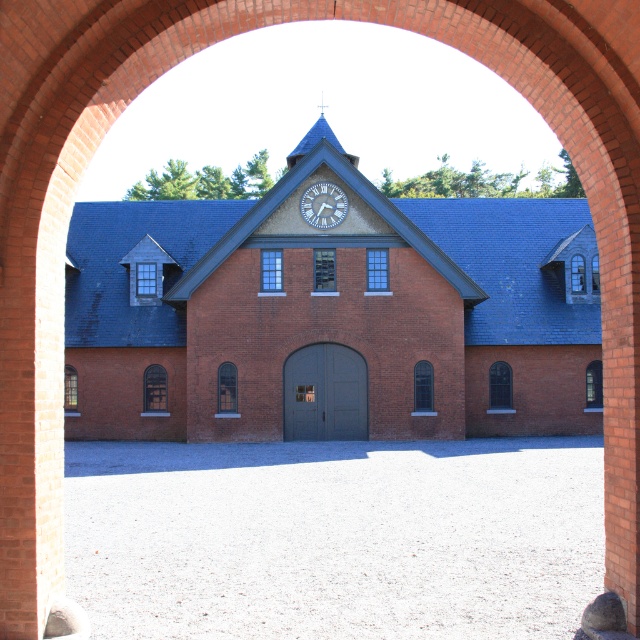
Question: Does brick building at center appear on the right side of white textured clock at upper center?

Choices:
 (A) yes
 (B) no

Answer: (A)

Question: Which point is farther to the camera?

Choices:
 (A) white textured clock at upper center
 (B) brick building at center

Answer: (A)

Question: In this image, where is brick building at center located relative to white textured clock at upper center?

Choices:
 (A) left
 (B) right

Answer: (B)

Question: Which point appears farthest from the camera in this image?

Choices:
 (A) (483, 211)
 (B) (320, 198)

Answer: (A)

Question: Which object is farther from the camera taking this photo?

Choices:
 (A) brick building at center
 (B) white textured clock at upper center

Answer: (B)

Question: Can you confirm if brick building at center is smaller than white textured clock at upper center?

Choices:
 (A) no
 (B) yes

Answer: (A)